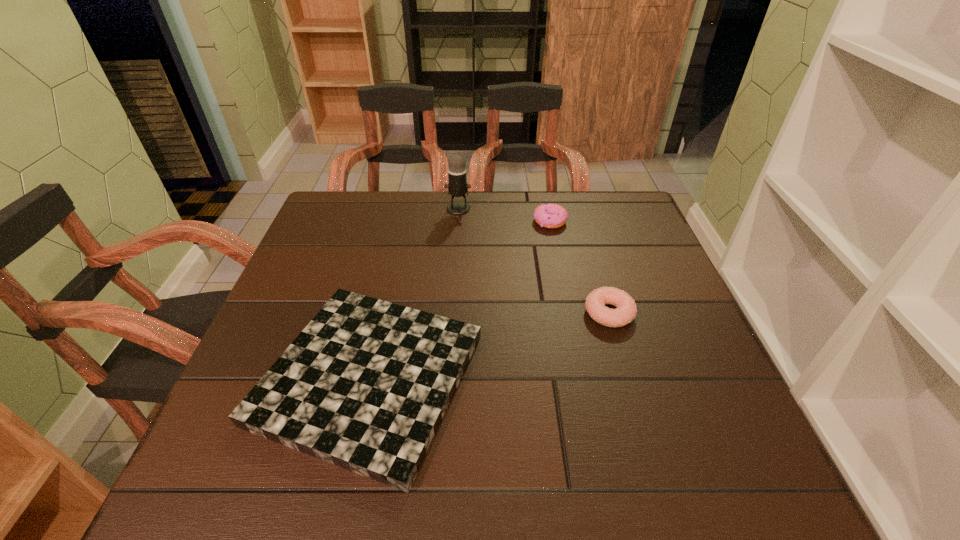
In order to click on object positioned at the near edge in this screenshot , I will do `click(365, 385)`.

Locate an element on the screen. Image resolution: width=960 pixels, height=540 pixels. object situated at the left edge is located at coordinates (365, 385).

The height and width of the screenshot is (540, 960). Find the location of `object that is at the right edge`. object that is at the right edge is located at coordinates (626, 310).

At what (x,y) coordinates should I click in order to perform the action: click on object positioned at the near left corner. Please return your answer as a coordinate pair (x, y). Looking at the image, I should click on (365, 385).

In the image, there is a desktop. Where is `vacant space at the far edge`? The width and height of the screenshot is (960, 540). vacant space at the far edge is located at coordinates tap(472, 202).

Locate an element on the screen. Image resolution: width=960 pixels, height=540 pixels. free region at the near edge of the desktop is located at coordinates (575, 486).

At what (x,y) coordinates should I click in order to perform the action: click on vacant region at the left edge of the desktop. Please return your answer as a coordinate pair (x, y). The width and height of the screenshot is (960, 540). Looking at the image, I should click on (276, 312).

The image size is (960, 540). I want to click on vacant space at the right edge of the desktop, so click(x=694, y=336).

This screenshot has height=540, width=960. I want to click on free space at the far left corner, so click(327, 203).

The height and width of the screenshot is (540, 960). In order to click on blank space at the far right corner in this screenshot , I will do `click(599, 229)`.